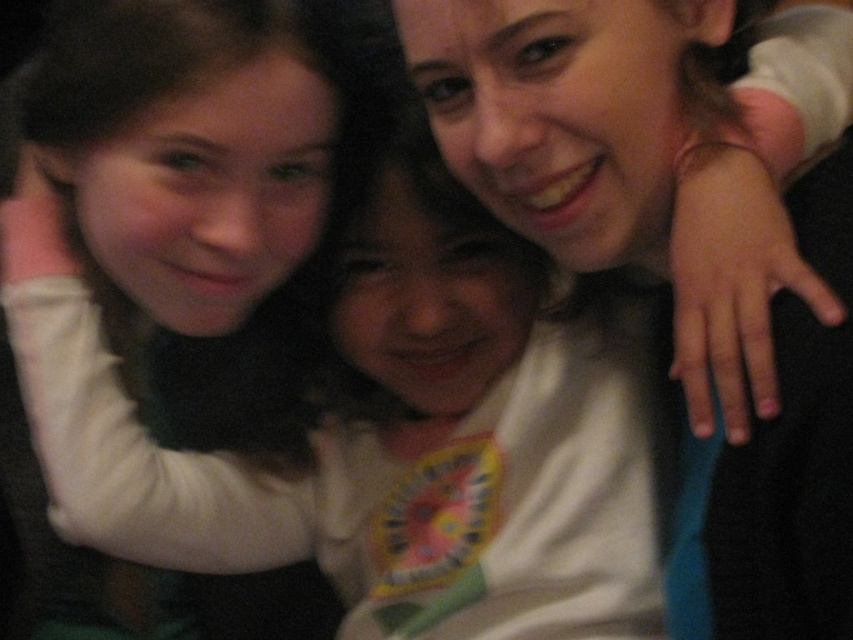
You are standing in front of the scene and want to touch both points. Which point should you reach for first, point (48, 406) or point (502, 51)?

You should reach for point (48, 406) first because it is closer to you than point (502, 51).